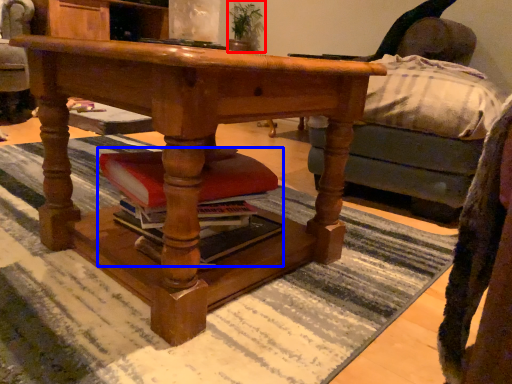
Question: Which object is closer to the camera taking this photo, houseplant (highlighted by a red box) or book (highlighted by a blue box)?

Choices:
 (A) houseplant
 (B) book

Answer: (B)